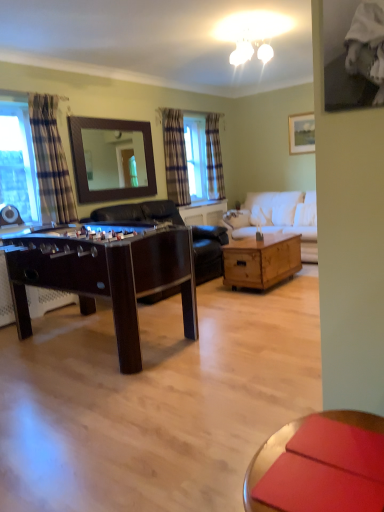
You are a GUI agent. You are given a task and a screenshot of the screen. Output one action in this format:
    pyautogui.click(x=<x>, y=<y>)
    Task: Click on the vacant space underneath smooth wooden coffee table at lower right (from a real-world perspective)
    The image size is (384, 512).
    Given the screenshot: What is the action you would take?
    pyautogui.click(x=317, y=488)